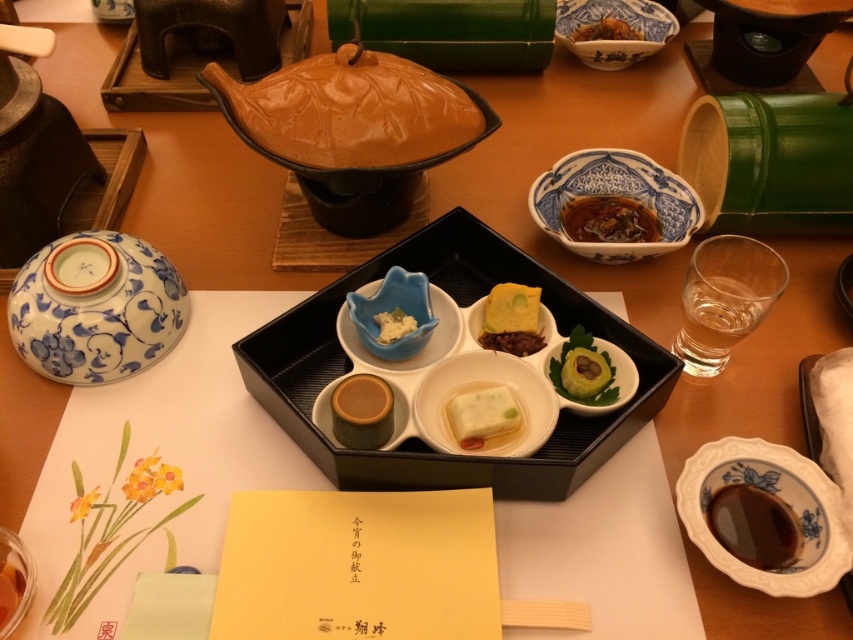
Question: Among these points, which one is farthest from the camera?

Choices:
 (A) (369, 397)
 (B) (821, 493)
 (C) (3, 618)

Answer: (A)

Question: Does blue ceramic bowl at center have a smaller size compared to white creamy rice at center?

Choices:
 (A) yes
 (B) no

Answer: (B)

Question: Does blue ceramic bowl at center appear over saucy brownish-red paste at upper center?

Choices:
 (A) yes
 (B) no

Answer: (B)

Question: Which of these objects is positioned closest to the saucy brownish-red paste at upper center?

Choices:
 (A) brown glazed clay pot at upper center
 (B) blue ceramic bowl at center
 (C) matte brown cylinder at center
 (D) white porcelain dish at center

Answer: (B)

Question: Which object appears closest to the camera in this image?

Choices:
 (A) shiny brown sauce at lower right
 (B) shiny brown rice at upper center
 (C) matte ceramic bowl at lower left
 (D) brown glazed clay pot at upper center

Answer: (C)

Question: In this image, where is brown glazed clay pot at upper center located relative to blue ceramic bowl at center?

Choices:
 (A) right
 (B) left

Answer: (B)